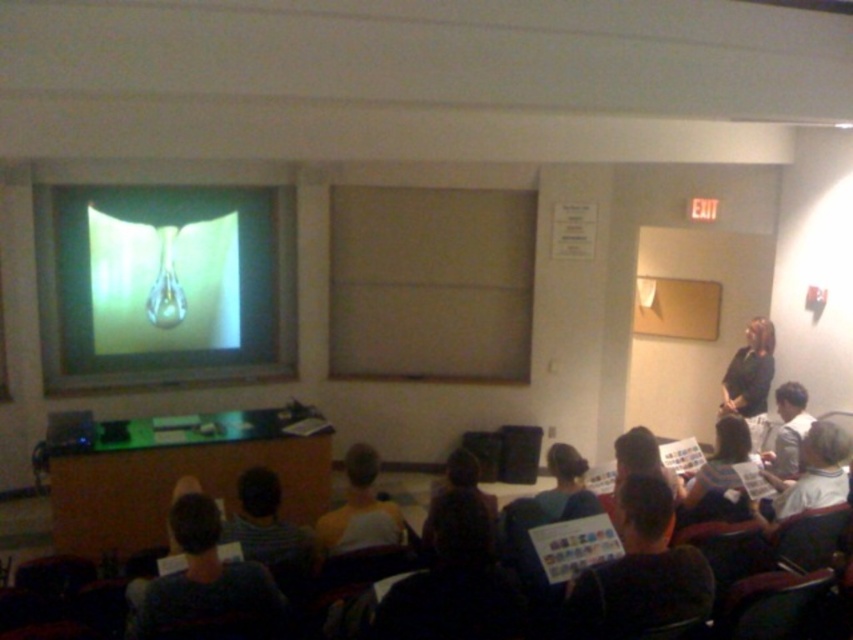
Question: Is translucent glass screen at upper left above dark gray sweater at center?

Choices:
 (A) no
 (B) yes

Answer: (B)

Question: Which of the following is the closest to the observer?

Choices:
 (A) translucent glass screen at upper left
 (B) dark gray shirt at lower left
 (C) dark gray sweater at center

Answer: (C)

Question: Which object appears closest to the camera in this image?

Choices:
 (A) translucent glass screen at upper left
 (B) yellow shirt at center
 (C) dark gray shirt at lower left

Answer: (C)

Question: Is dark gray sweater at center thinner than yellow shirt at center?

Choices:
 (A) yes
 (B) no

Answer: (B)

Question: Is translucent glass screen at upper left thinner than yellow shirt at center?

Choices:
 (A) no
 (B) yes

Answer: (A)

Question: Which object appears closest to the camera in this image?

Choices:
 (A) yellow shirt at center
 (B) dark gray sweater at center

Answer: (B)